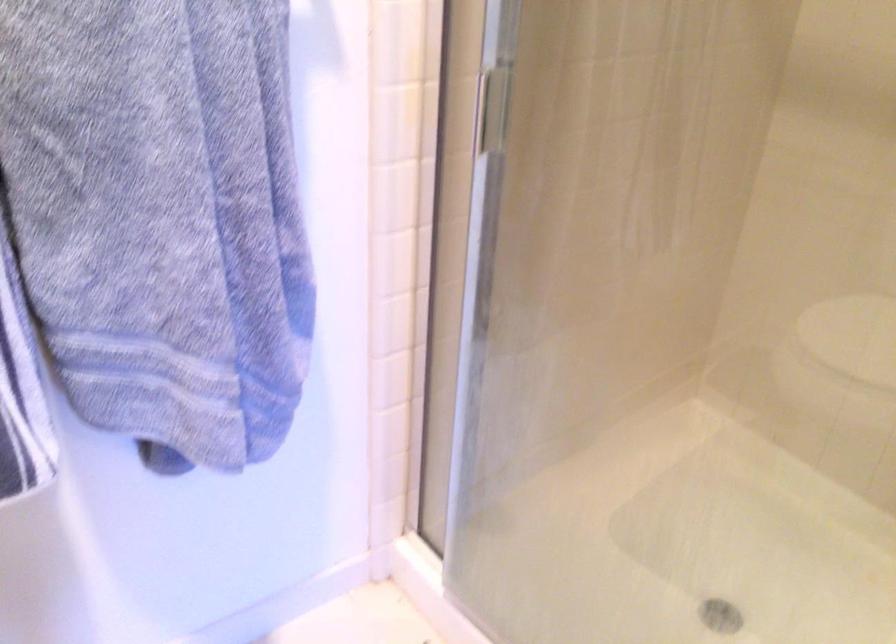
The image size is (896, 644). In order to click on shower door handle in this screenshot , I will do coord(501,31).